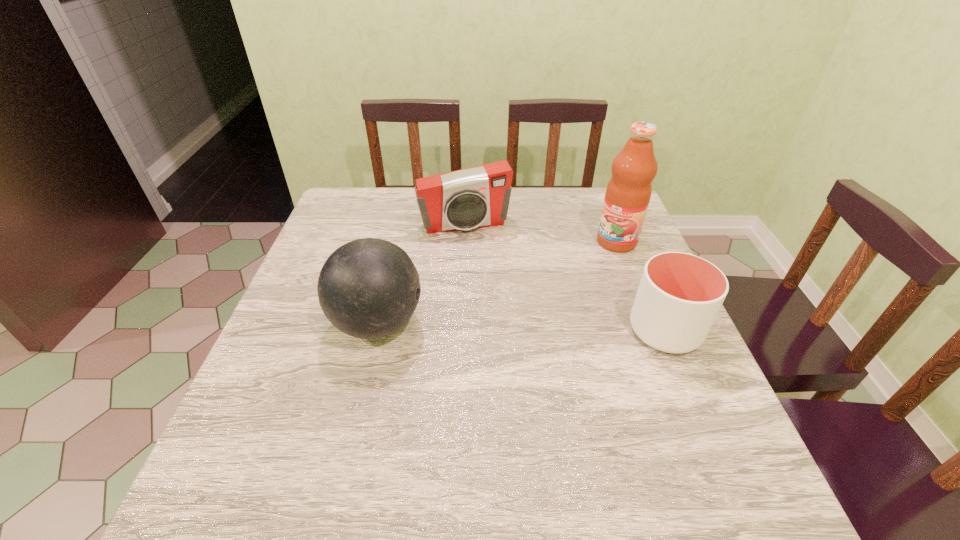
I want to click on free space located on the front-facing side of the camera, so click(x=481, y=258).

You are a GUI agent. You are given a task and a screenshot of the screen. Output one action in this format:
    pyautogui.click(x=<x>, y=<y>)
    Task: Click on the vacant space situated on the front-facing side of the camera
    
    Given the screenshot: What is the action you would take?
    pyautogui.click(x=480, y=256)

Find the location of a particular element. fruit juice that is at the far edge is located at coordinates (628, 193).

The width and height of the screenshot is (960, 540). In order to click on camera that is positioned at the far edge in this screenshot , I will do `click(475, 197)`.

The height and width of the screenshot is (540, 960). In order to click on object situated at the left edge in this screenshot , I will do `click(369, 288)`.

Locate an element on the screen. The image size is (960, 540). cup present at the right edge is located at coordinates (679, 296).

Locate an element on the screen. The width and height of the screenshot is (960, 540). fruit juice that is at the right edge is located at coordinates (628, 193).

The image size is (960, 540). What are the coordinates of `object present at the far right corner` in the screenshot? It's located at (628, 193).

At what (x,y) coordinates should I click in order to perform the action: click on vacant space at the far edge of the desktop. Please return your answer as a coordinate pair (x, y). Looking at the image, I should click on (406, 204).

You are a GUI agent. You are given a task and a screenshot of the screen. Output one action in this format:
    pyautogui.click(x=<x>, y=<y>)
    Task: Click on the free region at the near edge
    This screenshot has height=540, width=960.
    Given the screenshot: What is the action you would take?
    pyautogui.click(x=611, y=414)